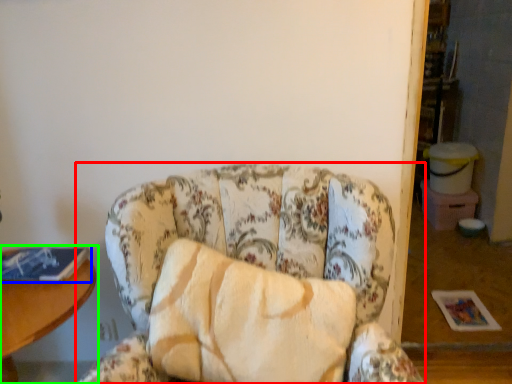
Question: Which is nearer to the chair (highlighted by a red box)? book (highlighted by a blue box) or table (highlighted by a green box).

Choices:
 (A) book
 (B) table

Answer: (B)